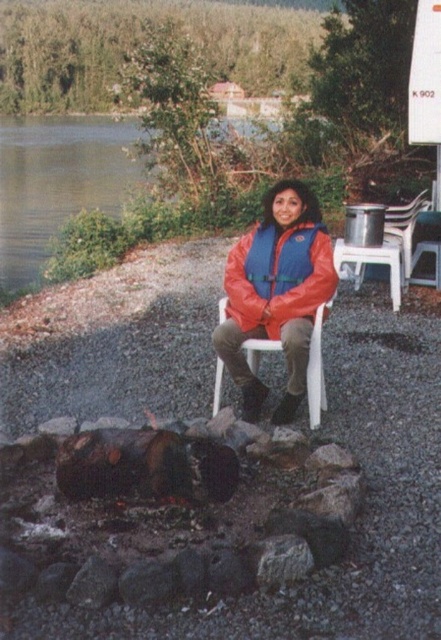
Question: Which of the following is the closest to the observer?

Choices:
 (A) orange nylon jacket at center
 (B) matte orange life vest at center
 (C) green grass at upper center

Answer: (B)

Question: Among these objects, which one is farthest from the camera?

Choices:
 (A) green grass at upper center
 (B) matte orange life vest at center
 (C) orange nylon jacket at center

Answer: (A)

Question: In this image, where is matte orange life vest at center located relative to orange nylon jacket at center?

Choices:
 (A) right
 (B) left

Answer: (B)

Question: Based on their relative distances, which object is farther from the orange nylon jacket at center?

Choices:
 (A) green grass at upper center
 (B) matte orange life vest at center

Answer: (A)

Question: Does matte orange life vest at center have a greater width compared to orange nylon jacket at center?

Choices:
 (A) no
 (B) yes

Answer: (B)

Question: Does matte orange life vest at center appear on the left side of green grass at upper center?

Choices:
 (A) yes
 (B) no

Answer: (B)